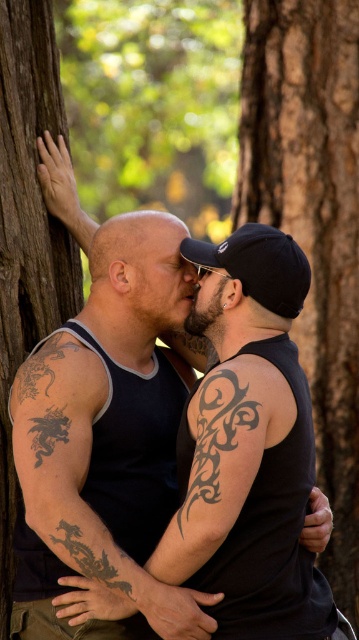
Looking at this image, you are a photographer trying to capture a closeup shot of both the black matte tank top at center and the brown rough bark at center in the same frame. Given that your camera has a minimum focusing distance of 1.5 meters, will you be able to achieve this shot?

The black matte tank top at center and brown rough bark at center are 1.69 meters apart, so yes, the camera can focus on both since the distance between them is greater than the minimum focusing distance of 1.5 meters.

You are a tailor measuring fabrics for alterations. You have a piece of fabric that is exactly the width of the brown rough tree trunk at left. Can you use this fabric to cover the black matte tank top at center without any adjustments?

The black matte tank top at center is wider than the brown rough tree trunk at left. Therefore, the fabric piece matching the tree trunk width would be insufficient to cover the tank top without resizing or additional material.

Looking at this image, you are a photographer aiming to capture the texture details of both the black matte tank top at center and the brown rough bark at center. Since you want to focus on the texture, which object should you prioritize focusing on first, considering their positions in the image?

The black matte tank top at center is below brown rough bark at center, so you should focus on the brown rough bark at center first because it is higher up and might be more visible in the frame.